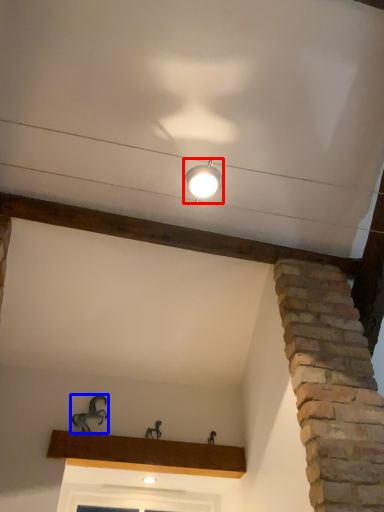
Question: Which object is further to the camera taking this photo, lamp (highlighted by a red box) or animal (highlighted by a blue box)?

Choices:
 (A) lamp
 (B) animal

Answer: (B)